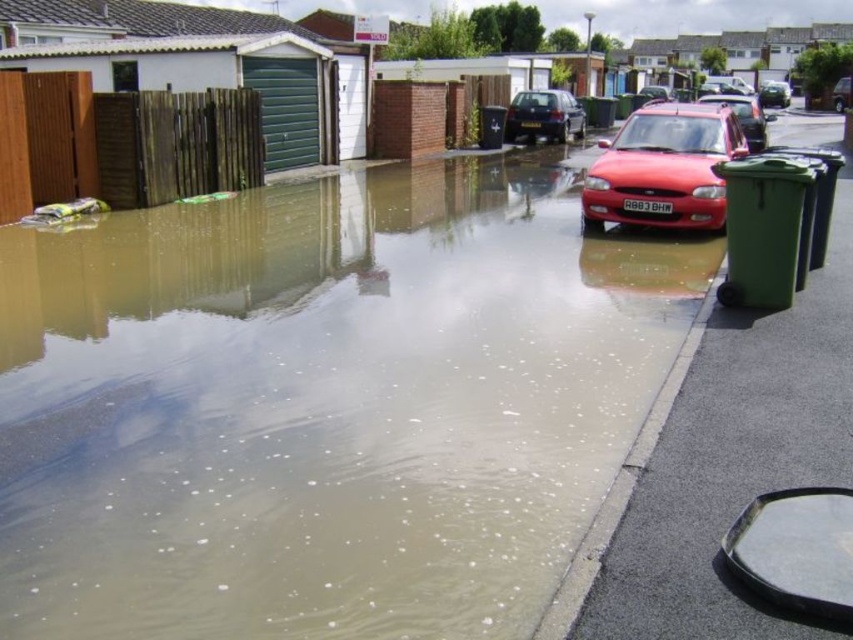
You are a delivery driver trying to navigate through the flooded street. You see the metallic red car at center and the metallic silver car at upper right. Which car is closer to you as you approach the scene?

The metallic red car at center is closer to you because it is in front of the metallic silver car at upper right, meaning it is positioned nearer to your viewpoint as you approach the scene.

You are a rescue worker assessing the flooded street. You see the metallic red car at center and the metallic silver car at upper right. Which car has a lower height? Please answer based on their positions in the image.

The metallic red car at center is shorter than the metallic silver car at upper right, so the metallic red car at center has a lower height.

You are standing at the edge of the flooded street and want to reach a point that is closer to you. Which point should you head towards, point 1 at coordinates [569,284] or point 2 at coordinates [846,80]?

You should head towards point 1 at coordinates [569,284] because it is closer to the camera than point 2 at coordinates [846,80].